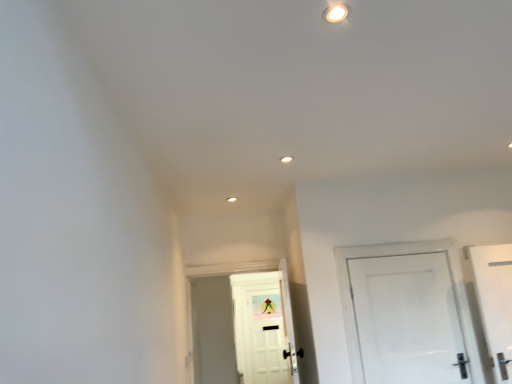
Question: From their relative heights in the image, would you say white glossy door at right, the first door viewed from the right, is taller or shorter than white matte door at center, which is counted as the 1th door, starting from the back?

Choices:
 (A) tall
 (B) short

Answer: (B)

Question: Does point (382, 279) appear closer or farther from the camera than point (290, 377)?

Choices:
 (A) closer
 (B) farther

Answer: (A)

Question: Is white glossy door at right, which is the 1th door from front to back, in front of or behind white matte door at center, the 2th door in the right-to-left sequence, in the image?

Choices:
 (A) behind
 (B) front

Answer: (B)

Question: Is white matte door at center, which is counted as the first door, starting from the left, in front of or behind white glossy door at right, the first door viewed from the right, in the image?

Choices:
 (A) front
 (B) behind

Answer: (B)

Question: From the image's perspective, is white matte door at center, the 2th door in the right-to-left sequence, located above or below white glossy door at right, which is the 1th door from front to back?

Choices:
 (A) above
 (B) below

Answer: (B)

Question: Considering the positions of white matte door at center, which is counted as the 1th door, starting from the back, and white glossy door at right, the second door viewed from the left, in the image, is white matte door at center, which is counted as the 1th door, starting from the back, bigger or smaller than white glossy door at right, the second door viewed from the left,?

Choices:
 (A) small
 (B) big

Answer: (B)

Question: Is white matte door at center, which is counted as the 1th door, starting from the back, wider or thinner than white glossy door at right, the first door viewed from the right?

Choices:
 (A) wide
 (B) thin

Answer: (A)